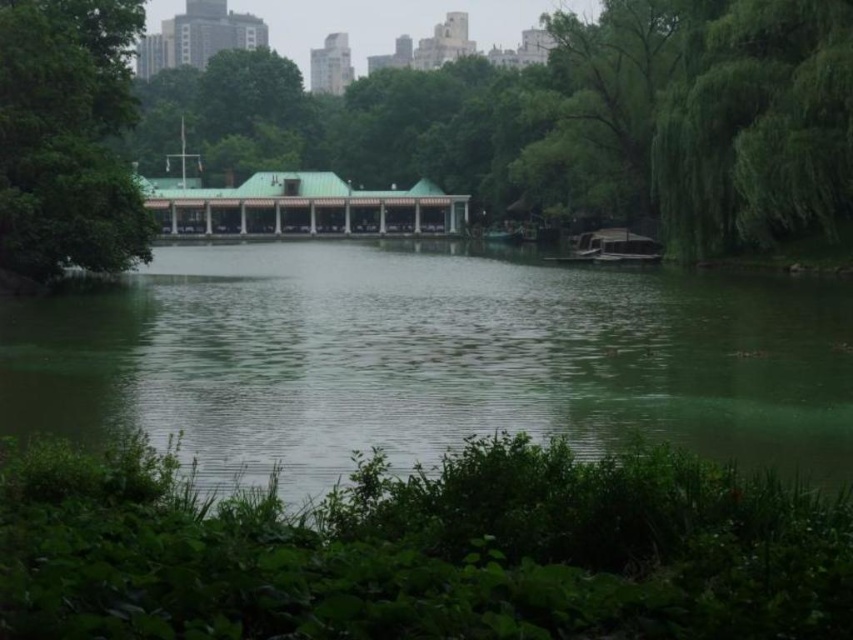
Is green smooth water at center shorter than green leafy tree at upper right?

Yes.

Is green smooth water at center behind green leafy tree at upper right?

No, green smooth water at center is closer to the viewer.

Between point (305, 417) and point (778, 68), which one is positioned in front?

Point (305, 417)

Where is `green smooth water at center`? The width and height of the screenshot is (853, 640). green smooth water at center is located at coordinates (431, 358).

Looking at this image, does green leafy tree at center have a greater height compared to green leafy tree at upper right?

Indeed, green leafy tree at center has a greater height compared to green leafy tree at upper right.

Locate an element on the screen. This screenshot has width=853, height=640. green leafy tree at center is located at coordinates (561, 120).

Identify the location of green leafy tree at center. (561, 120).

Is point (263, 426) more distant than point (9, 150)?

No, (263, 426) is closer to viewer.

Between point (563, 298) and point (123, 176), which one is positioned behind?

Positioned behind is point (123, 176).

Locate an element on the screen. This screenshot has width=853, height=640. green smooth water at center is located at coordinates (431, 358).